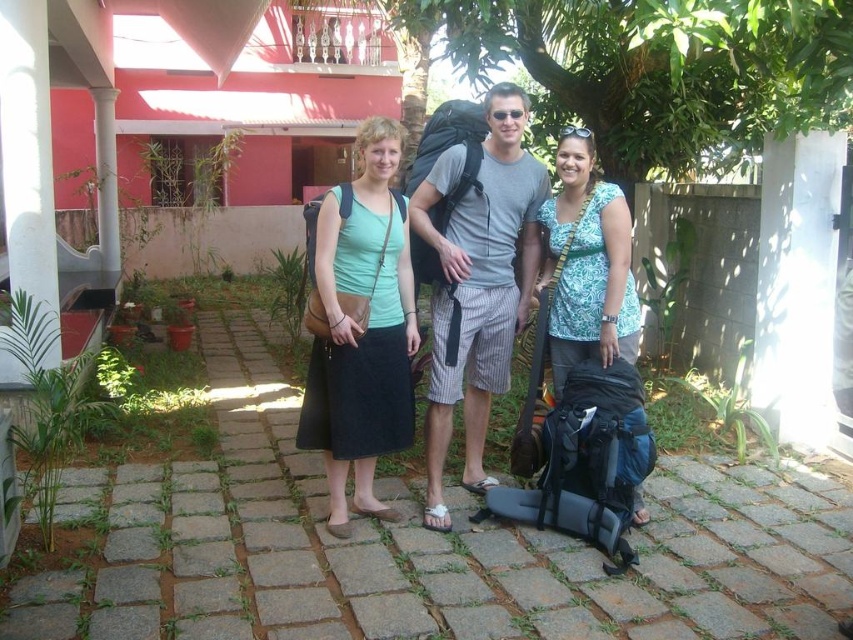
Question: Among these objects, which one is farthest from the camera?

Choices:
 (A) printed fabric shirt at center
 (B) gray cotton t-shirt at center
 (C) matte green tank top at center
 (D) matte black backpack at center

Answer: (B)

Question: Estimate the real-world distances between objects in this image. Which object is closer to the matte black backpack at center?

Choices:
 (A) gray cotton t-shirt at center
 (B) printed fabric shirt at center
 (C) matte green tank top at center

Answer: (A)

Question: Is matte green tank top at center positioned in front of printed fabric shirt at center?

Choices:
 (A) no
 (B) yes

Answer: (B)

Question: Does matte black backpack at center come behind printed fabric shirt at center?

Choices:
 (A) no
 (B) yes

Answer: (B)

Question: Among these objects, which one is nearest to the camera?

Choices:
 (A) gray cotton t-shirt at center
 (B) matte green tank top at center
 (C) matte black backpack at center

Answer: (B)

Question: Does matte green tank top at center appear over gray cotton t-shirt at center?

Choices:
 (A) no
 (B) yes

Answer: (A)